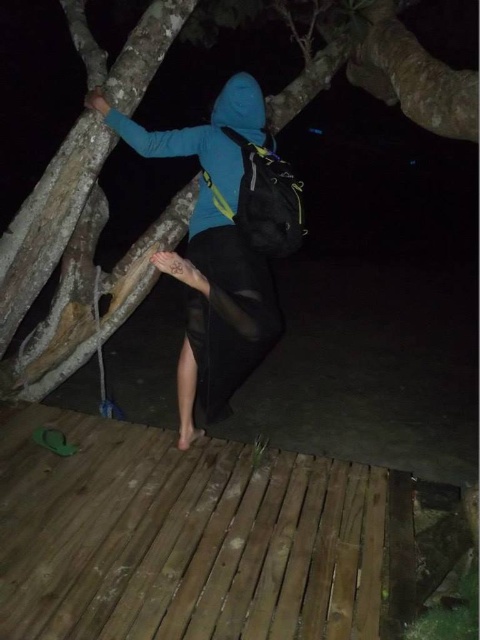
Is point (319, 72) positioned in front of point (255, 84)?

No, (319, 72) is further to viewer.

Which is above, rough bark tree at upper center or blue matte jacket at upper center?

rough bark tree at upper center is above.

Does point (374, 64) come farther from viewer compared to point (235, 330)?

Yes, it is.

Where is `rough bark tree at upper center`? rough bark tree at upper center is located at coordinates (389, 77).

From the picture: Is blue matte jacket at upper center wider than blue fleece hoodie at upper center?

Indeed, blue matte jacket at upper center has a greater width compared to blue fleece hoodie at upper center.

Between blue matte jacket at upper center and blue fleece hoodie at upper center, which one has less height?

blue fleece hoodie at upper center is shorter.

The height and width of the screenshot is (640, 480). Describe the element at coordinates (214, 253) in the screenshot. I see `blue matte jacket at upper center` at that location.

This screenshot has height=640, width=480. Identify the location of blue matte jacket at upper center. (214, 253).

Who is taller, rough bark tree at upper center or blue fleece hoodie at upper center?

Standing taller between the two is rough bark tree at upper center.

Is point (400, 93) positioned after point (156, 138)?

No, (400, 93) is closer to viewer.

Locate an element on the screen. rough bark tree at upper center is located at coordinates (389, 77).